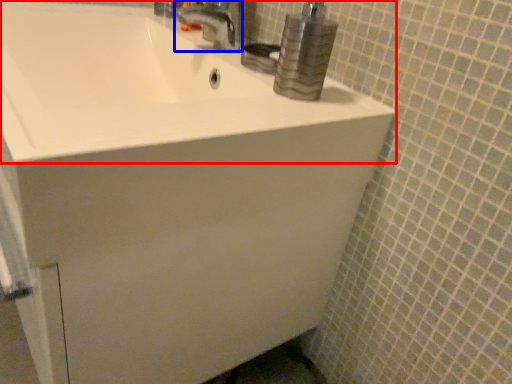
Question: Which of the following is the farthest to the observer, sink (highlighted by a red box) or tap (highlighted by a blue box)?

Choices:
 (A) sink
 (B) tap

Answer: (B)